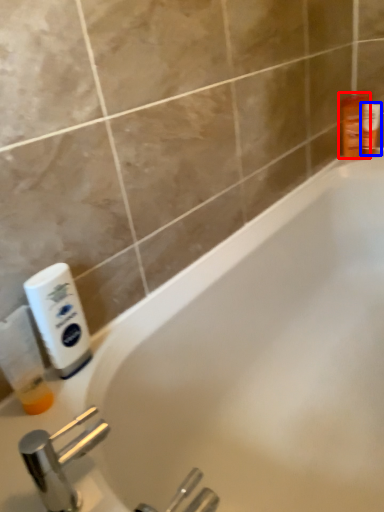
Question: Which object is further to the camera taking this photo, toiletry (highlighted by a red box) or toiletry (highlighted by a blue box)?

Choices:
 (A) toiletry
 (B) toiletry

Answer: (B)